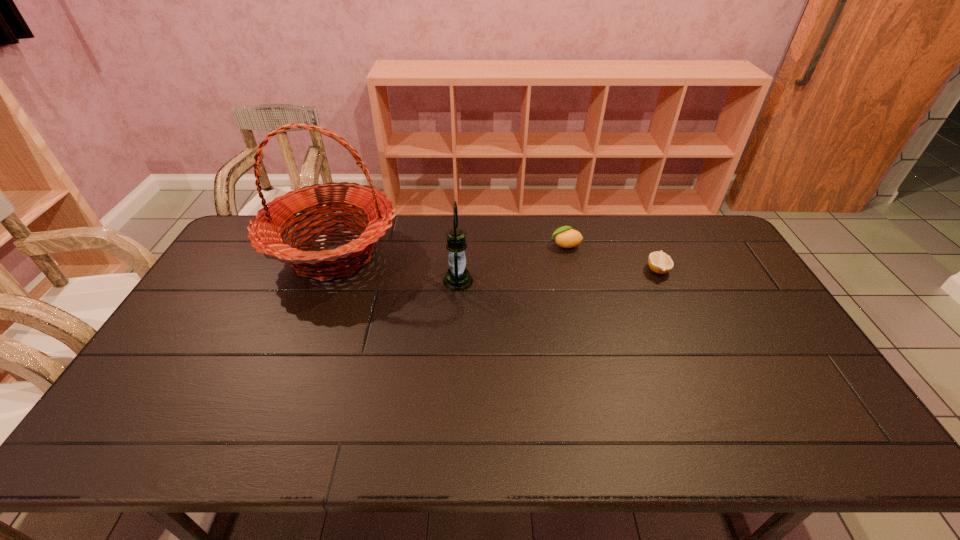
I want to click on object that ranks as the second closest to the right lemon, so click(457, 278).

Locate an element on the screen. This screenshot has height=540, width=960. free location that satisfies the following two spatial constraints: 1. with leaves positioned above the second object from right to left; 2. on the back side of the nearer lemon is located at coordinates (571, 270).

What are the coordinates of `vacant position in the image that satisfies the following two spatial constraints: 1. with leaves positioned above the farther lemon; 2. on the front side of the basket` in the screenshot? It's located at (567, 254).

Identify the location of free space that satisfies the following two spatial constraints: 1. with leaves positioned above the farther lemon; 2. on the front side of the tallest object. The height and width of the screenshot is (540, 960). (567, 254).

Find the location of a particular element. vacant space that satisfies the following two spatial constraints: 1. on the back side of the shorter lemon; 2. with leaves positioned above the third object from left to right is located at coordinates (646, 245).